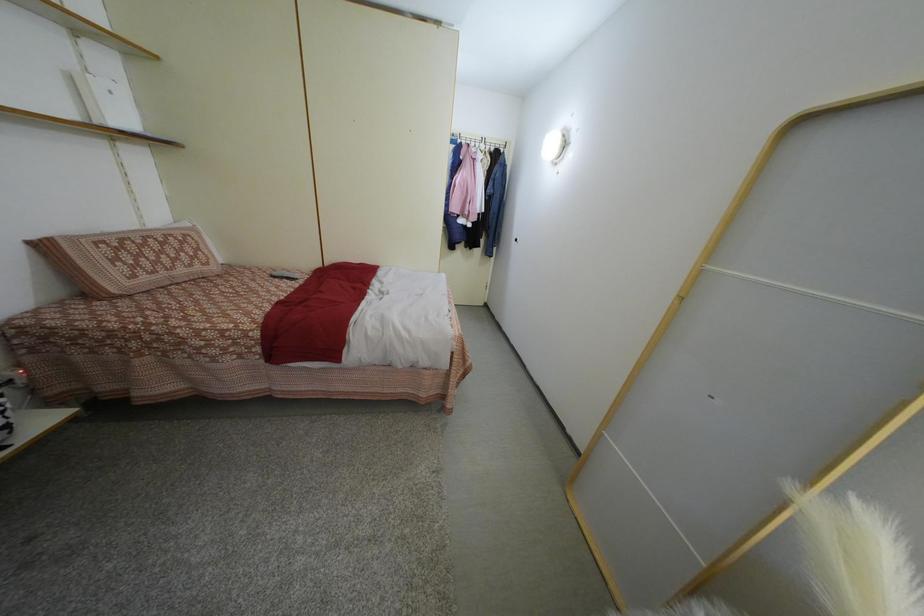
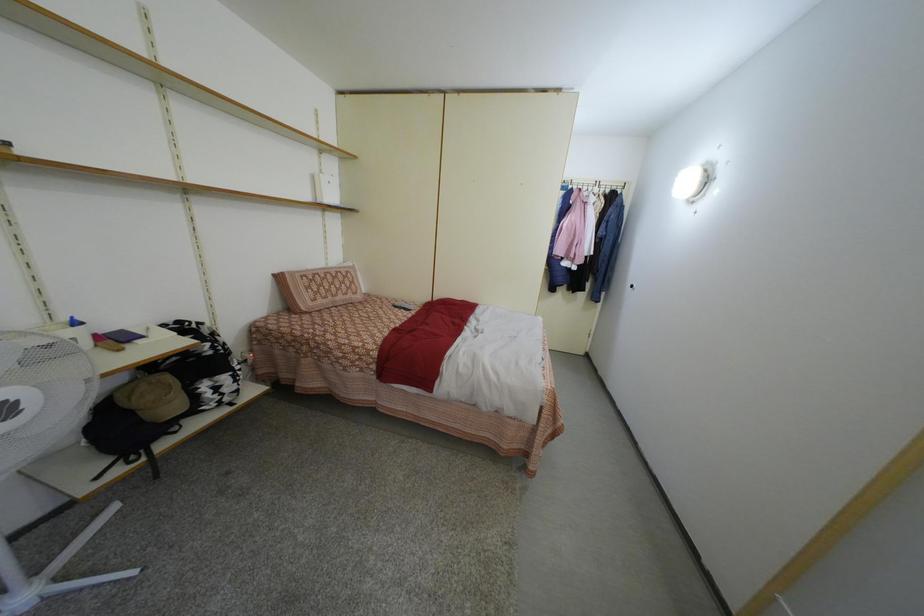
Which direction would the cameraman need to move to produce the second image?

The cameraman moved toward left, forward.